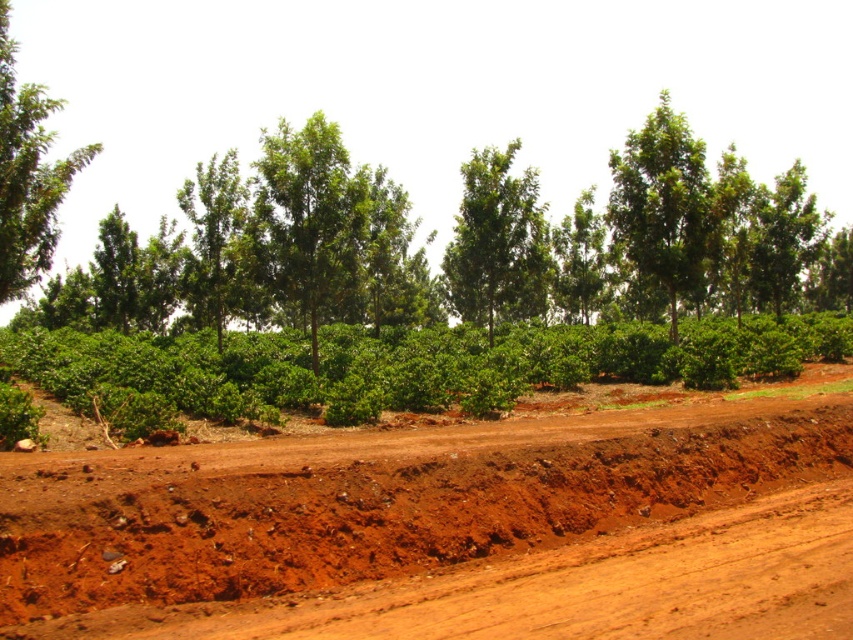
You are a surveyor using a coordinate system where the bottom left corner is the origin. You need to locate the brown soil at center. What are its coordinates?

The coordinates of the brown soil at center are at point [451,525].

You are standing at the bottom left of the dirt road in the rural landscape. You see two points marked on the road. One is at point (167, 630) and the other is at point (610, 160). Which point is closer to you?

Point (167, 630) is closer to the viewer than point (610, 160).